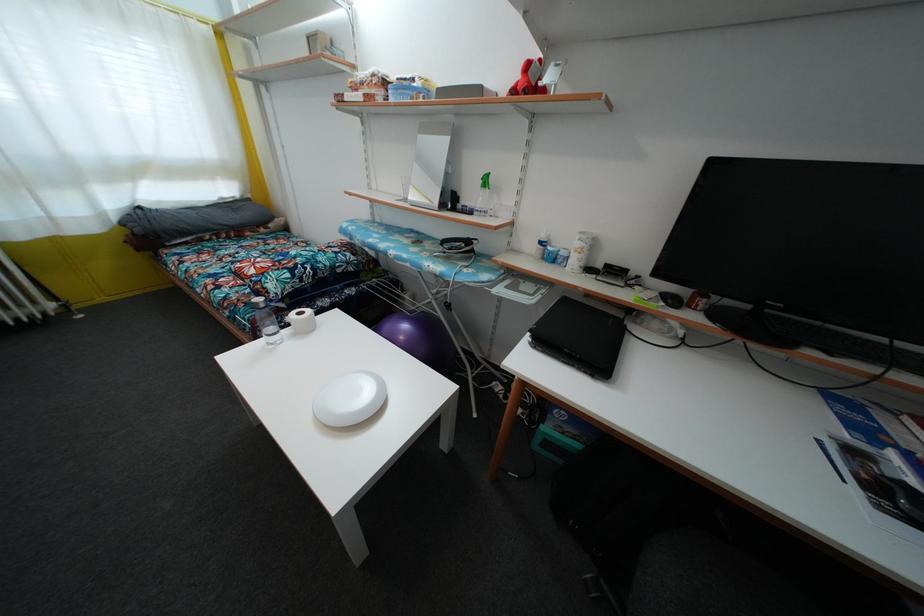
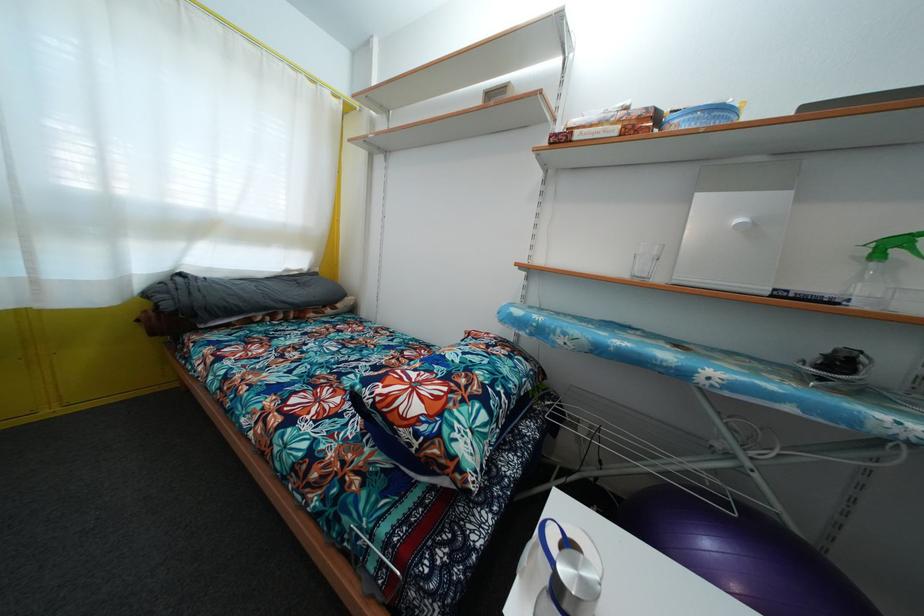
In a continuous first-person perspective shot, in which direction is the camera moving?

The cameraman moved toward left, forward.